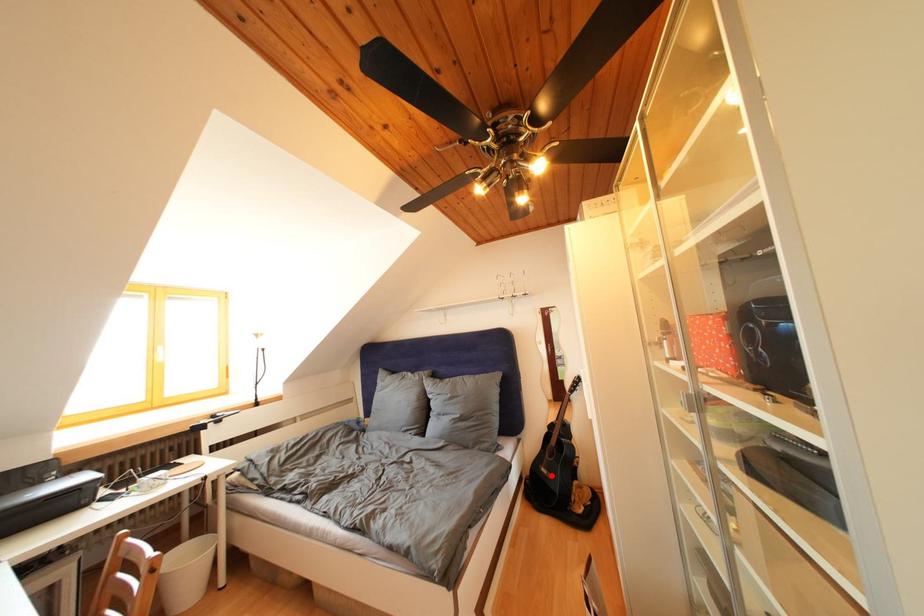
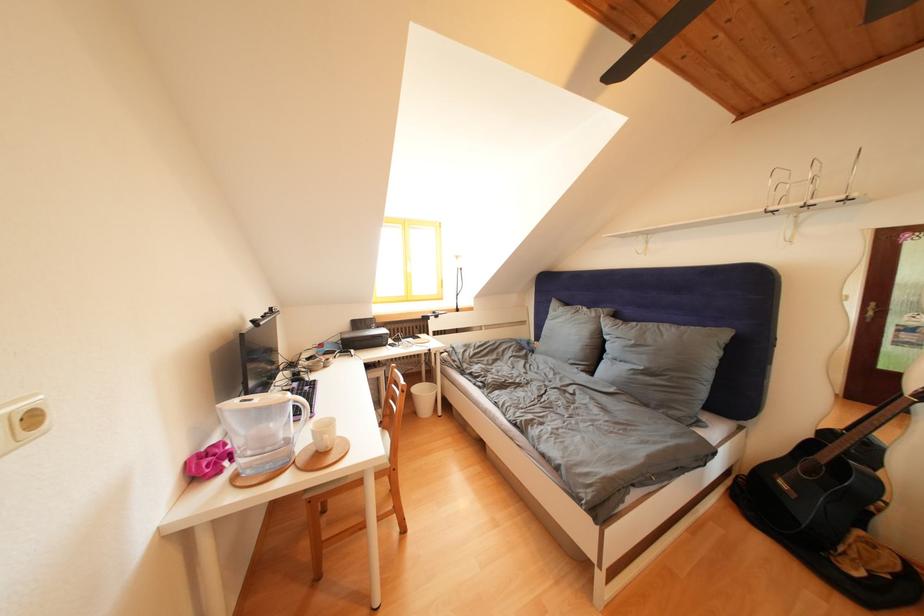
Find the pixel in the second image that matches the highlighted location in the first image.

(791, 488)